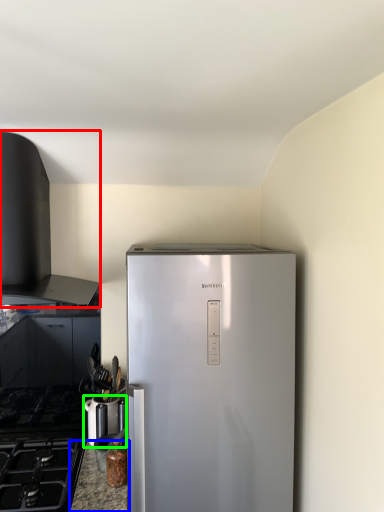
Question: Considering the real-world distances, which object is farthest from vent (highlighted by a red box)? counter top (highlighted by a blue box) or appliance (highlighted by a green box)?

Choices:
 (A) counter top
 (B) appliance

Answer: (A)